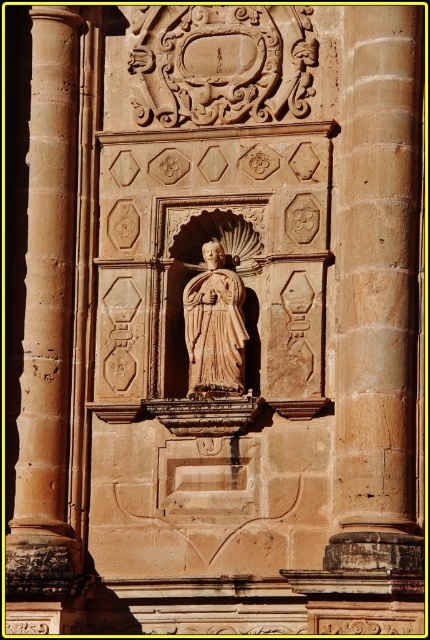
Is smooth stone pillar at center closer to camera compared to beige stone statue at center?

Yes, smooth stone pillar at center is in front of beige stone statue at center.

Who is more distant from viewer, [355,396] or [197,368]?

Positioned behind is point [197,368].

Identify the location of smooth stone pillar at center. The image size is (430, 640). (377, 294).